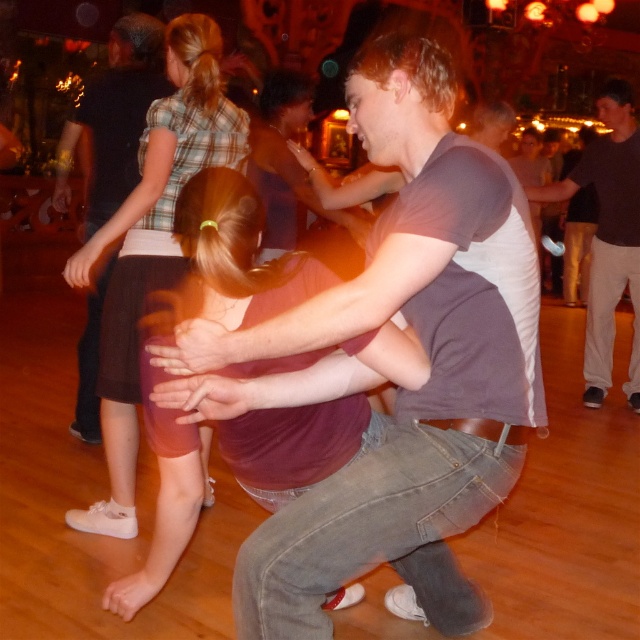
Which is more to the right, brown skirt at lower left or matte brown shirt at center?

brown skirt at lower left

Can you confirm if brown skirt at lower left is positioned below matte brown shirt at center?

Indeed, brown skirt at lower left is positioned under matte brown shirt at center.

Between point (228, 150) and point (96, 429), which one is positioned behind?

The point (96, 429) is behind.

At what (x,y) coordinates should I click in order to perform the action: click on brown skirt at lower left. Please return your answer as a coordinate pair (x, y). The width and height of the screenshot is (640, 640). Looking at the image, I should click on (152, 243).

Can you confirm if matte gray t-shirt at center is wider than matte brown shirt at center?

No.

Who is positioned more to the left, matte gray t-shirt at center or matte brown shirt at center?

matte brown shirt at center

Is point (532, 419) closer to viewer compared to point (80, 369)?

Yes, point (532, 419) is closer to viewer.

The height and width of the screenshot is (640, 640). Identify the location of matte gray t-shirt at center. (403, 388).

Is the position of brown skirt at lower left less distant than that of dark gray shirt at center?

That is True.

Is point (141, 145) farther from camera compared to point (557, 193)?

No, it is not.

What do you see at coordinates (152, 243) in the screenshot? I see `brown skirt at lower left` at bounding box center [152, 243].

Where is `brown skirt at lower left`? brown skirt at lower left is located at coordinates (152, 243).